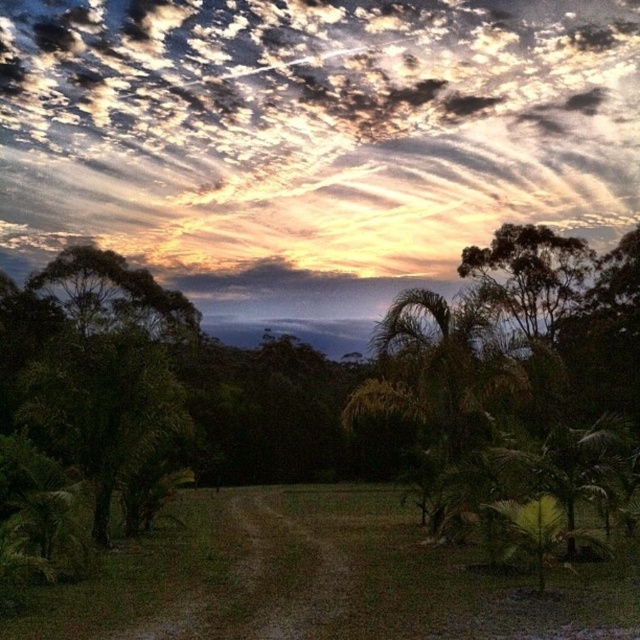
Question: Which of the following is the farthest from the observer?

Choices:
 (A) green leafy tree at upper right
 (B) green leafy tree at left
 (C) cloudy sky at upper center
 (D) green leafy palm at center

Answer: (C)

Question: Does green leafy palm at center lie behind green leafy tree at upper right?

Choices:
 (A) no
 (B) yes

Answer: (A)

Question: Which point appears closest to the camera in this image?

Choices:
 (A) (189, 264)
 (B) (19, 403)

Answer: (B)

Question: Does cloudy sky at upper center appear over green leafy tree at upper right?

Choices:
 (A) no
 (B) yes

Answer: (B)

Question: Which object is positioned closest to the green leafy tree at left?

Choices:
 (A) green leafy palm at center
 (B) green leafy tree at upper right
 (C) cloudy sky at upper center

Answer: (A)

Question: Where is cloudy sky at upper center located in relation to green leafy tree at left in the image?

Choices:
 (A) right
 (B) left

Answer: (A)